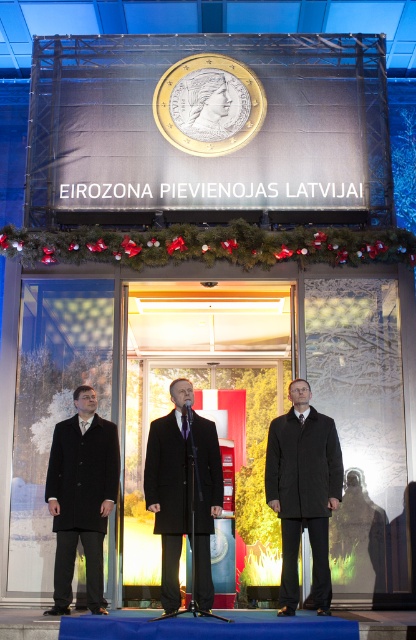
You are at a formal event under the banner stating Eurozone Joins Latvia. You notice two points marked on the stage area. The first point is at coordinates point (89, 412) and the second is at point (198, 563). If you are standing in front of the stage, which point is closer to the back of the stage?

Point (89, 412) is behind point (198, 563), so the point at (89, 412) is closer to the back of the stage.

You are attending the event and need to determine which of the two men at center is wearing the thinner coat. The two men are wearing a dark gray wool coat at center and a black matte suit at center. Which one has the thinner coat?

The dark gray wool coat at center is thinner than the black matte suit at center, so the man wearing the dark gray wool coat at center has the thinner coat.